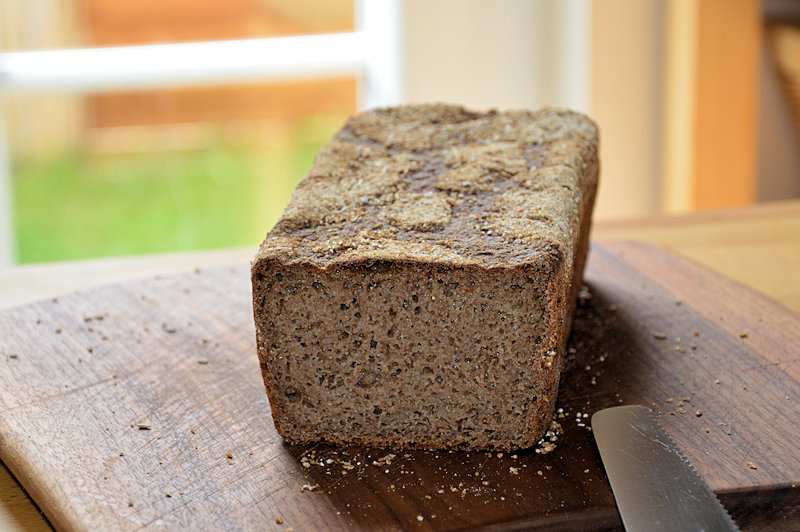
Locate an element on the screen. Image resolution: width=800 pixels, height=532 pixels. window is located at coordinates (164, 133).